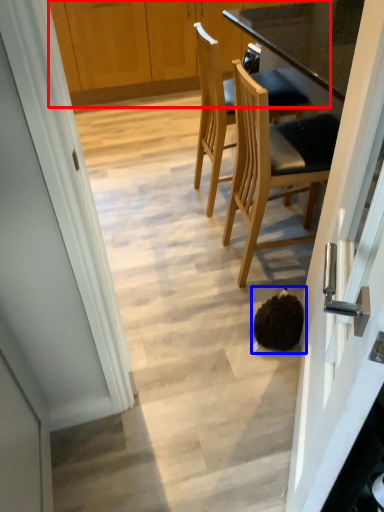
Question: Which object is closer to the camera taking this photo, cabinetry (highlighted by a red box) or head (highlighted by a blue box)?

Choices:
 (A) cabinetry
 (B) head

Answer: (B)